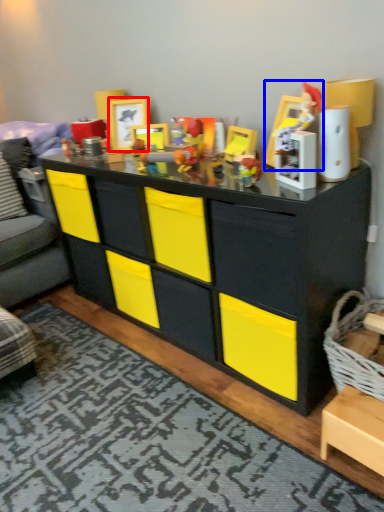
Question: Which of the following is the farthest to the observer, picture frame (highlighted by a red box) or toy (highlighted by a blue box)?

Choices:
 (A) picture frame
 (B) toy

Answer: (A)